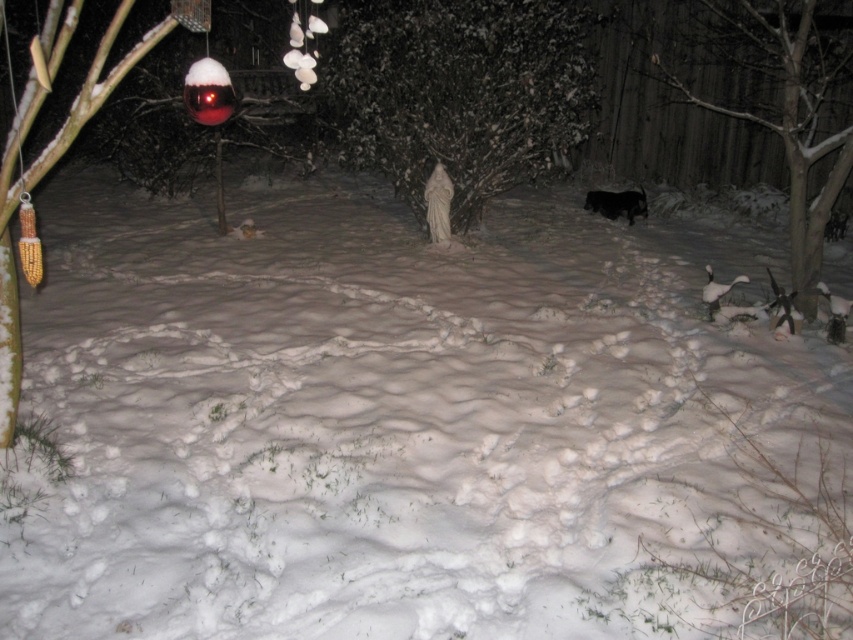
Can you confirm if white fluffy snow at center is bigger than white frosted statue at center?

Indeed, white fluffy snow at center has a larger size compared to white frosted statue at center.

Is white fluffy snow at center positioned before white frosted statue at center?

Yes.

Where is `white fluffy snow at center`? The width and height of the screenshot is (853, 640). white fluffy snow at center is located at coordinates (415, 428).

Can you confirm if white fluffy snow at center is wider than snow-covered tree at right?

Yes, white fluffy snow at center is wider than snow-covered tree at right.

Does white fluffy snow at center appear on the left side of snow-covered tree at right?

Indeed, white fluffy snow at center is positioned on the left side of snow-covered tree at right.

The height and width of the screenshot is (640, 853). What do you see at coordinates (415, 428) in the screenshot? I see `white fluffy snow at center` at bounding box center [415, 428].

The image size is (853, 640). Identify the location of white fluffy snow at center. (415, 428).

Which is more to the right, white frosted statue at center or yellow corn cob at left?

white frosted statue at center

Who is shorter, white frosted statue at center or yellow corn cob at left?

yellow corn cob at left is shorter.

The width and height of the screenshot is (853, 640). What do you see at coordinates (461, 92) in the screenshot? I see `white frosted statue at center` at bounding box center [461, 92].

Find the location of a particular element. This screenshot has width=853, height=640. white frosted statue at center is located at coordinates (461, 92).